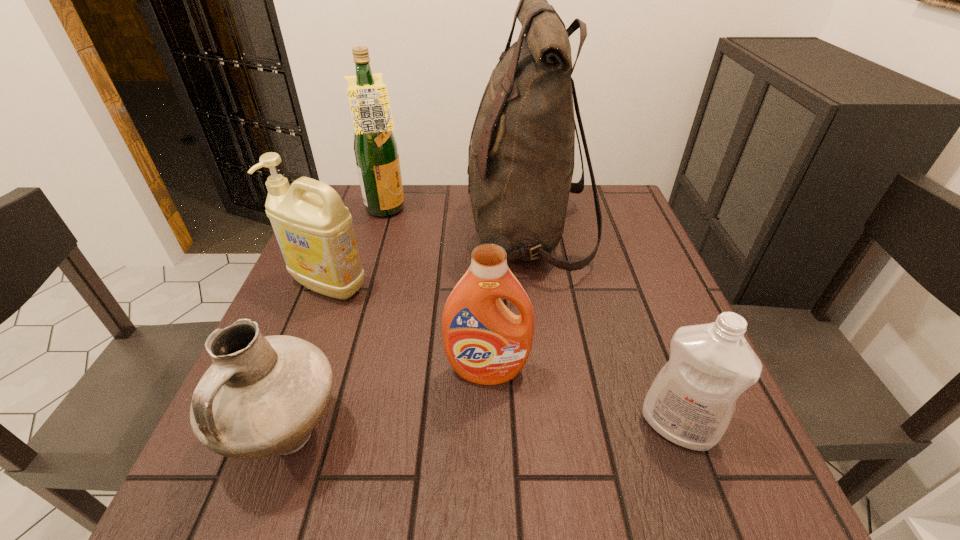
Select which detergent appears as the second closest to the pitcher. Please provide its 2D coordinates. Your answer should be formatted as a tuple, i.e. [(x, y)], where the tuple contains the x and y coordinates of a point satisfying the conditions above.

[(314, 230)]

Where is `detergent that is the third closest to the pitcher`? detergent that is the third closest to the pitcher is located at coordinates (x=691, y=402).

Identify the location of free space that satisfies the following two spatial constraints: 1. on the back side of the rightmost detergent; 2. on the front-facing side of the liquor. The image size is (960, 540). (598, 211).

Find the location of a particular element. The width and height of the screenshot is (960, 540). vacant region that satisfies the following two spatial constraints: 1. on the open flap of the tallest object; 2. on the left side of the rightmost detergent is located at coordinates (555, 426).

Where is `blank space that satisfies the following two spatial constraints: 1. on the open flap of the tallest object; 2. on the front side of the farthest detergent`? Image resolution: width=960 pixels, height=540 pixels. blank space that satisfies the following two spatial constraints: 1. on the open flap of the tallest object; 2. on the front side of the farthest detergent is located at coordinates (536, 285).

Where is `free region that satisfies the following two spatial constraints: 1. on the open flap of the tallest object; 2. on the handle side of the pitcher`? This screenshot has height=540, width=960. free region that satisfies the following two spatial constraints: 1. on the open flap of the tallest object; 2. on the handle side of the pitcher is located at coordinates (557, 435).

Identify the location of free spot that satisfies the following two spatial constraints: 1. on the front-facing side of the rightmost detergent; 2. on the right side of the liquor. (324, 426).